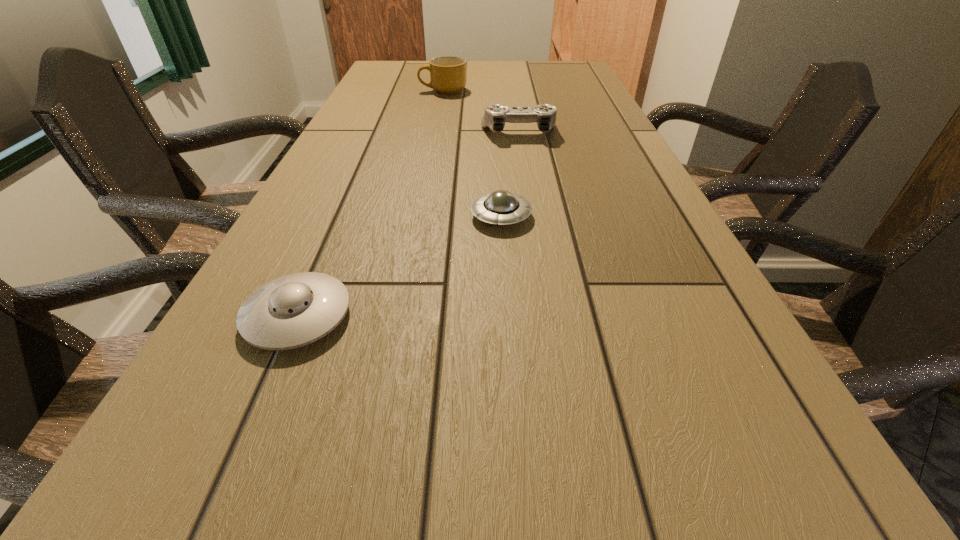
The image size is (960, 540). What are the coordinates of `empty location between the nearest object and the second nearest object` in the screenshot? It's located at (399, 266).

Where is `empty space between the right saucer and the left saucer`? This screenshot has height=540, width=960. empty space between the right saucer and the left saucer is located at coordinates (399, 266).

Locate an element on the screen. empty location between the left saucer and the second nearest object is located at coordinates (399, 266).

You are a GUI agent. You are given a task and a screenshot of the screen. Output one action in this format:
    pyautogui.click(x=<x>, y=<y>)
    Task: Click on the vacant region between the left saucer and the second tallest object
    The image size is (960, 540).
    Given the screenshot: What is the action you would take?
    pyautogui.click(x=408, y=224)

You are a GUI agent. You are given a task and a screenshot of the screen. Output one action in this format:
    pyautogui.click(x=<x>, y=<y>)
    Task: Click on the vacant point located between the right saucer and the nearer saucer
    This screenshot has width=960, height=540.
    Given the screenshot: What is the action you would take?
    pyautogui.click(x=399, y=266)

Where is `free area in between the nearest object and the second farthest object`? Image resolution: width=960 pixels, height=540 pixels. free area in between the nearest object and the second farthest object is located at coordinates (408, 224).

Locate an element on the screen. free area in between the farthest object and the left saucer is located at coordinates (371, 203).

Find the location of a particular element. The width and height of the screenshot is (960, 540). vacant space that is in between the tallest object and the control is located at coordinates (481, 111).

At what (x,y) coordinates should I click in order to perform the action: click on unoccupied position between the second nearest object and the control. Please return your answer as a coordinate pair (x, y). This screenshot has width=960, height=540. Looking at the image, I should click on (510, 174).

Locate an element on the screen. This screenshot has height=540, width=960. object that ranks as the second closest to the nearest object is located at coordinates (495, 115).